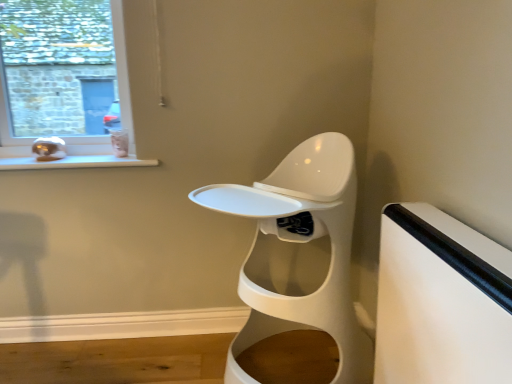
Question: Is white glossy toilet at center in front of or behind white glossy window sill at lower left in the image?

Choices:
 (A) front
 (B) behind

Answer: (A)

Question: Would you say white glossy toilet at center is to the left or to the right of white glossy window sill at lower left in the picture?

Choices:
 (A) right
 (B) left

Answer: (A)

Question: Which of these objects is positioned closest to the matte glass window at upper left?

Choices:
 (A) white glossy window sill at lower left
 (B) white matte table at right
 (C) white glossy toilet at center

Answer: (A)

Question: Considering the real-world distances, which object is farthest from the white glossy toilet at center?

Choices:
 (A) white matte table at right
 (B) white glossy window sill at lower left
 (C) matte glass window at upper left

Answer: (C)